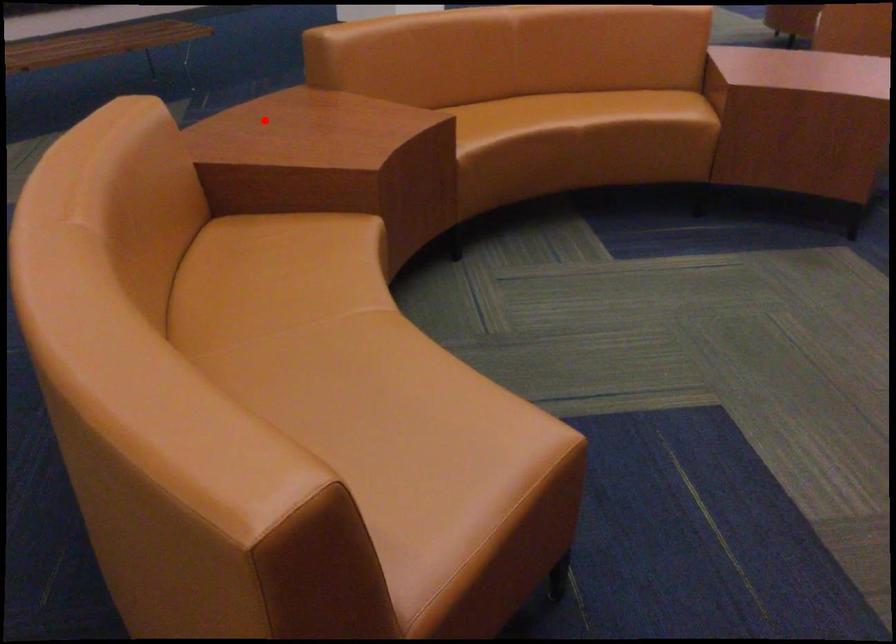
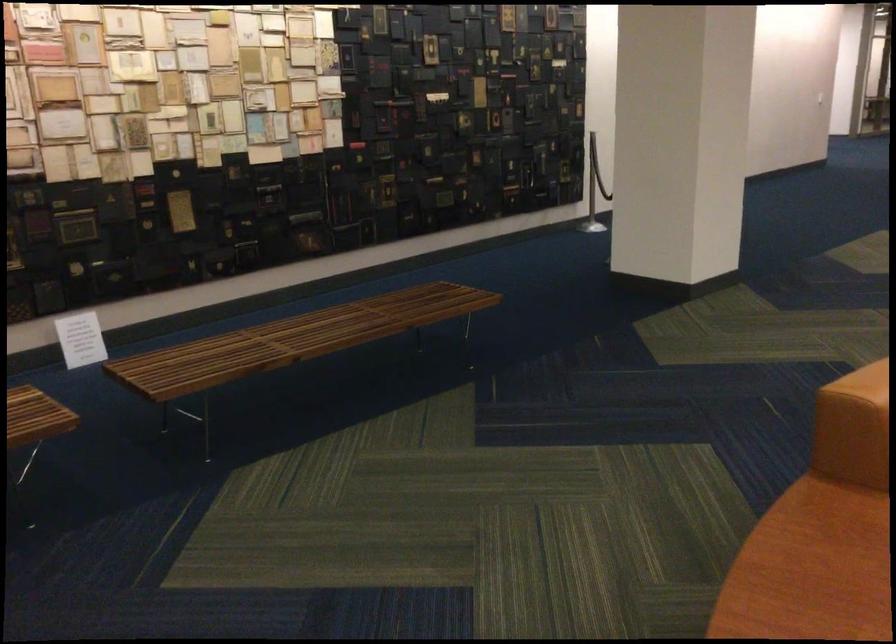
Question: I am providing you with two images of the same scene from different viewpoints. Image1 has a red point marked. In image2, the corresponding 3D location appears at what relative position? Reply with the corresponding letter.

Choices:
 (A) Closer
 (B) Farther

Answer: (A)